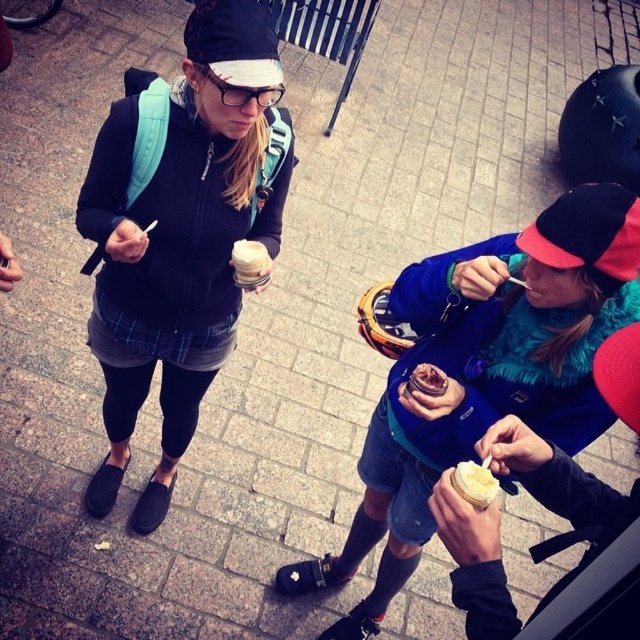
You are standing in the plaza and want to walk from point A to point B. Point A is at coordinate point(276,52) and point B is at coordinate point(465,499). Which point is closer to you when you start walking?

Point A at coordinate point(276,52) is closer to you since it is further to the viewer than point B at coordinate point(465,499).

You are standing at the entrance of the plaza and see the matte black jacket at center. Where is it positioned relative to the paved area?

The matte black jacket at center is located at point [179,230] on the paved area.